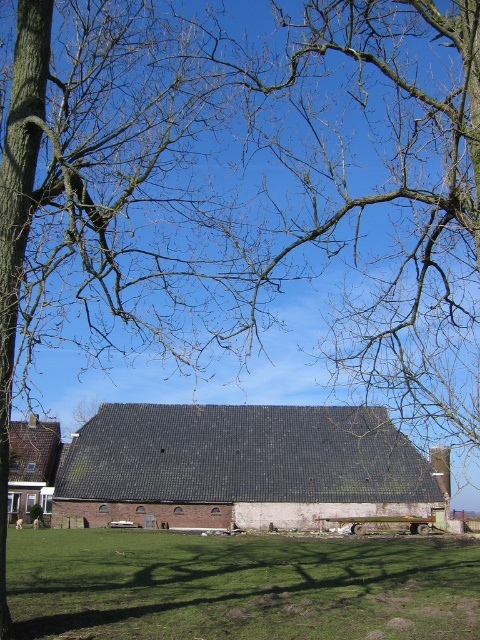
You are standing in the rural scene and want to place a new garden ornament. You have two options for placement based on the objects in the image. Which object, green grass at lower center or dark gray shingles at center, is located to the left of the other?

The green grass at lower center is positioned on the left side of dark gray shingles at center.

You are standing at the barn and want to walk to the point labeled point (47, 445). There is an obstacle at point (178, 492). Will you encounter the obstacle before reaching your destination?

Yes, you will encounter the obstacle at point (178, 492) before reaching the destination at point (47, 445) because the obstacle is closer to the camera than the destination.

You are standing in the rural scene and need to locate the dark gray shingles at center and the brown tiled barn at lower left. According to the scene, which object is positioned to the right of the other?

The dark gray shingles at center is positioned on the right side of brown tiled barn at lower left.